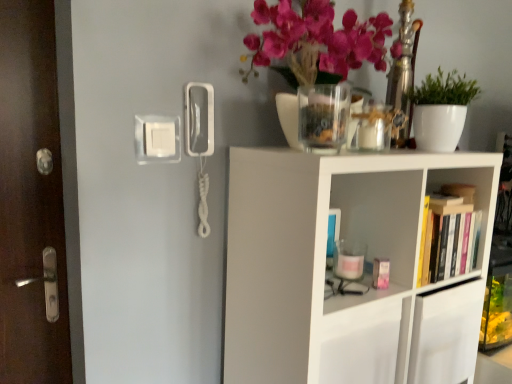
Question: Is hardcover book at right smaller than brown wooden door at left?

Choices:
 (A) no
 (B) yes

Answer: (B)

Question: Is hardcover book at right far from brown wooden door at left?

Choices:
 (A) yes
 (B) no

Answer: (A)

Question: Is hardcover book at right thinner than brown wooden door at left?

Choices:
 (A) no
 (B) yes

Answer: (A)

Question: From the image's perspective, is hardcover book at right below brown wooden door at left?

Choices:
 (A) no
 (B) yes

Answer: (B)

Question: Does hardcover book at right have a greater width compared to brown wooden door at left?

Choices:
 (A) yes
 (B) no

Answer: (A)

Question: From the image's perspective, is white matte shelf at upper right above or below white matte plant at upper right?

Choices:
 (A) below
 (B) above

Answer: (A)

Question: Is white matte shelf at upper right situated inside white matte plant at upper right or outside?

Choices:
 (A) inside
 (B) outside

Answer: (B)

Question: From a real-world perspective, is white matte shelf at upper right physically located above or below white matte plant at upper right?

Choices:
 (A) below
 (B) above

Answer: (A)

Question: Based on their positions, is white matte shelf at upper right located to the left or right of white matte plant at upper right?

Choices:
 (A) left
 (B) right

Answer: (A)

Question: Does point (50, 122) appear closer or farther from the camera than point (478, 92)?

Choices:
 (A) farther
 (B) closer

Answer: (B)

Question: Considering the positions of brown wooden door at left and white matte plant at upper right in the image, is brown wooden door at left taller or shorter than white matte plant at upper right?

Choices:
 (A) tall
 (B) short

Answer: (A)

Question: Is brown wooden door at left inside or outside of white matte plant at upper right?

Choices:
 (A) outside
 (B) inside

Answer: (A)

Question: Considering their positions, is brown wooden door at left located in front of or behind white matte plant at upper right?

Choices:
 (A) behind
 (B) front

Answer: (B)

Question: Looking at the image, does white matte shelf at upper right seem bigger or smaller compared to brown wooden door at left?

Choices:
 (A) small
 (B) big

Answer: (B)

Question: From their relative heights in the image, would you say white matte shelf at upper right is taller or shorter than brown wooden door at left?

Choices:
 (A) tall
 (B) short

Answer: (B)